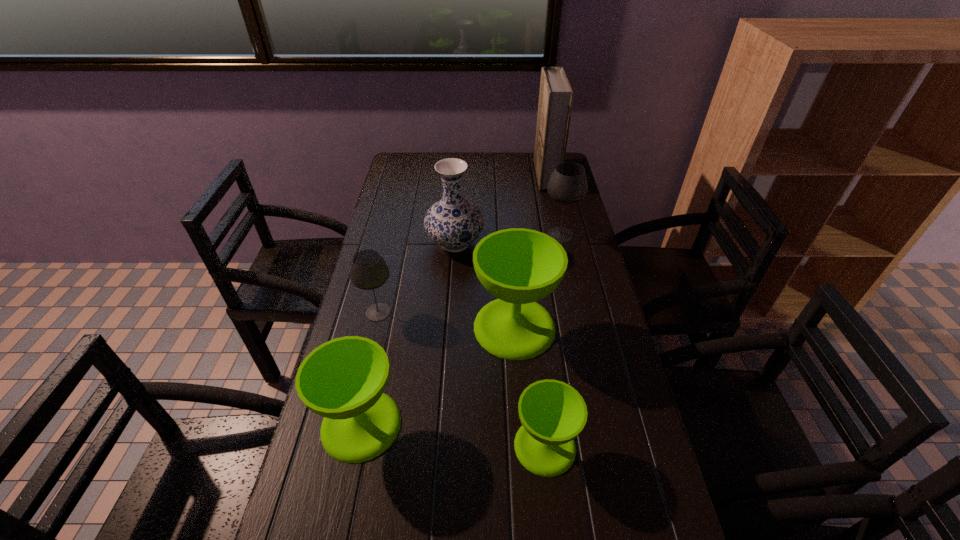
Find the location of `object that stands as the closest to the smaller gray wineglass`. object that stands as the closest to the smaller gray wineglass is located at coordinates (453, 222).

Identify which wineglass is the nearest to the nearest object. Please provide its 2D coordinates. Your answer should be formatted as a tuple, i.e. [(x, y)], where the tuple contains the x and y coordinates of a point satisfying the conditions above.

[(343, 380)]

This screenshot has width=960, height=540. I want to click on wineglass that is the second closest to the diary, so click(552, 413).

Identify which gray wineglass is located as the second nearest to the farthest green wineglass. Please provide its 2D coordinates. Your answer should be formatted as a tuple, i.e. [(x, y)], where the tuple contains the x and y coordinates of a point satisfying the conditions above.

[(568, 184)]

The height and width of the screenshot is (540, 960). Find the location of `green wineglass that is the second closest one to the diary`. green wineglass that is the second closest one to the diary is located at coordinates (552, 413).

At what (x,y) coordinates should I click in order to perform the action: click on green wineglass identified as the third closest to the tallest object. Please return your answer as a coordinate pair (x, y). The image size is (960, 540). Looking at the image, I should click on (343, 380).

Locate an element on the screen. The height and width of the screenshot is (540, 960). free space in the image that satisfies the following two spatial constraints: 1. on the cover of the farthest object; 2. on the front side of the biggest green wineglass is located at coordinates (579, 327).

Where is `free location that satisfies the following two spatial constraints: 1. on the cover of the farthest object; 2. on the left side of the farther gray wineglass`? free location that satisfies the following two spatial constraints: 1. on the cover of the farthest object; 2. on the left side of the farther gray wineglass is located at coordinates (559, 235).